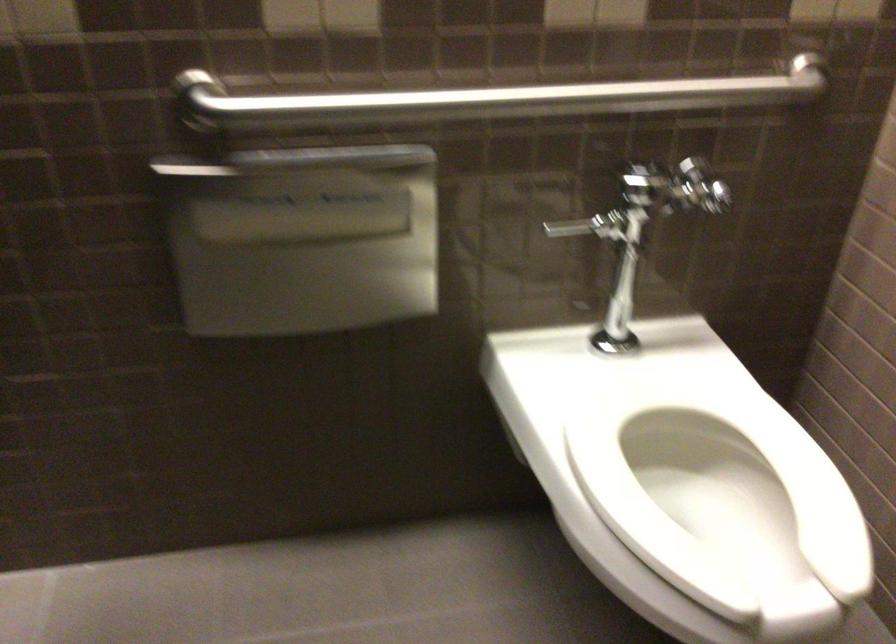
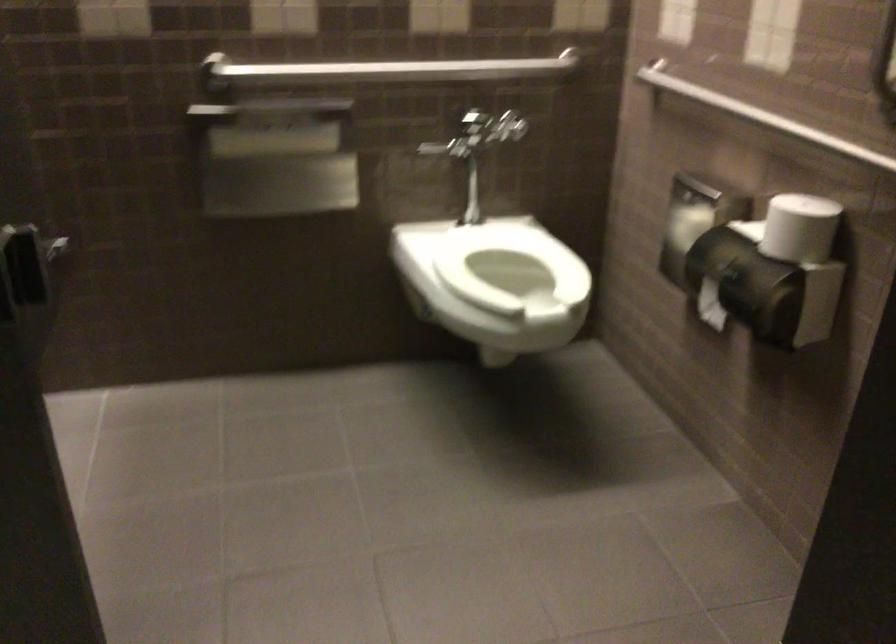
Find the pixel in the second image that matches (x=504, y=108) in the first image.

(391, 69)